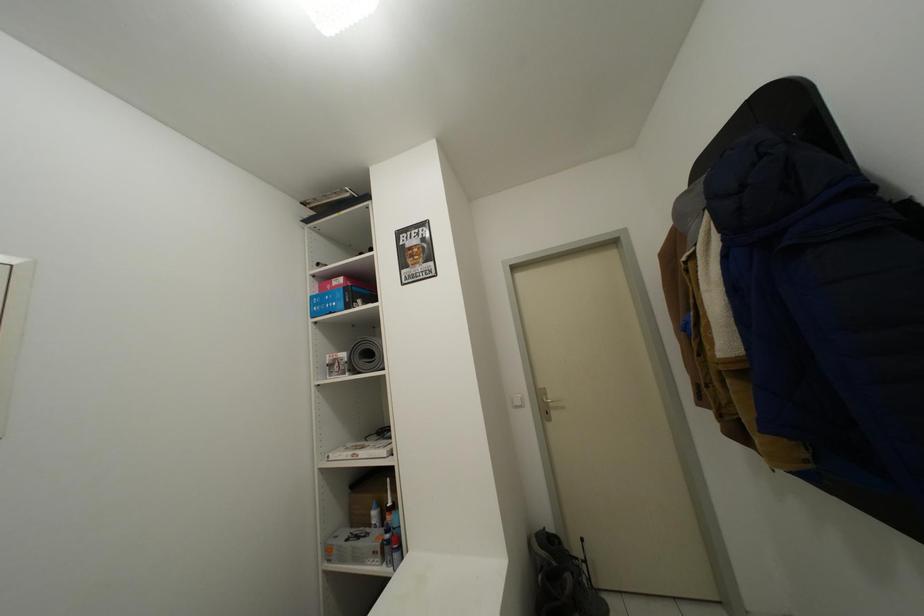
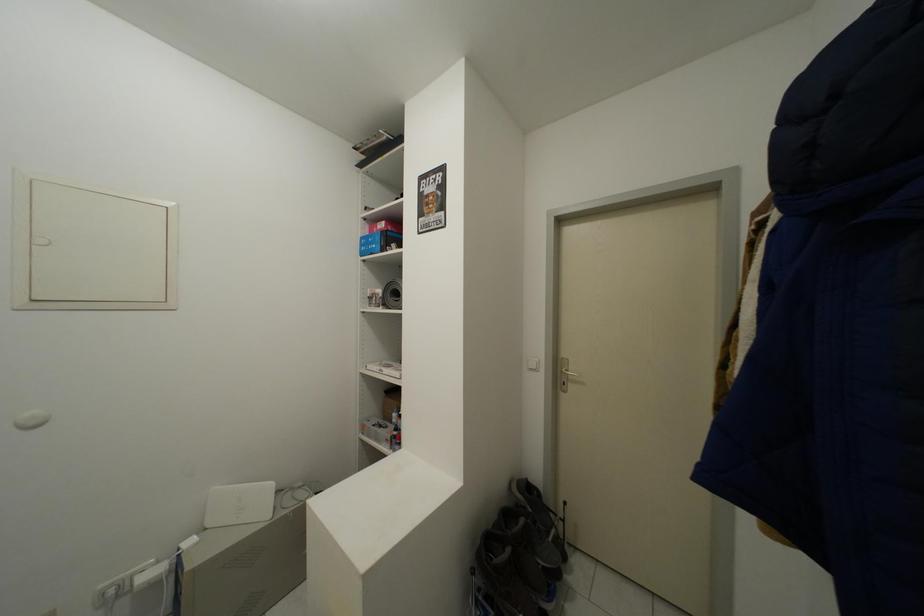
Question: The camera is either moving clockwise (left) or counter-clockwise (right) around the object. The first image is from the beginning of the video and the second image is from the end. Is the camera moving left or right when shooting the video?

Choices:
 (A) Left
 (B) Right

Answer: (B)